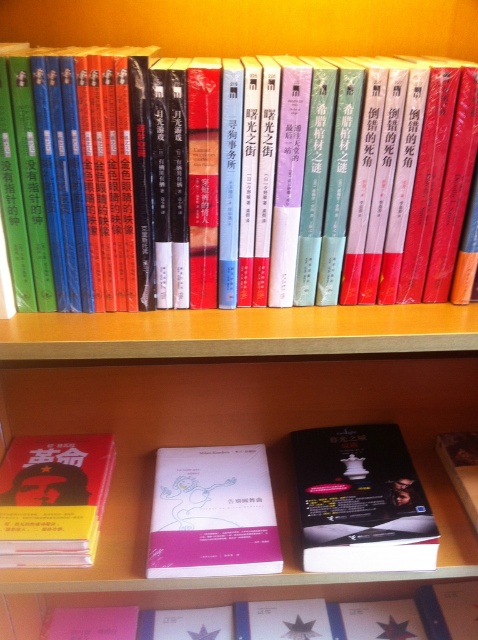
Which is in front, point (388, 547) or point (263, 492)?

Point (388, 547) is in front.

Between black matte book at center and pink matte book at center, which one has more height?

With more height is black matte book at center.

Is point (312, 547) behind point (147, 561)?

No, it is not.

The image size is (478, 640). I want to click on black matte book at center, so pyautogui.click(x=360, y=500).

Is hardcover book at center above pink matte book at center?

Yes, hardcover book at center is above pink matte book at center.

Describe the element at coordinates (245, 184) in the screenshot. I see `hardcover book at center` at that location.

What do you see at coordinates (245, 184) in the screenshot? I see `hardcover book at center` at bounding box center [245, 184].

Find the location of `hardcover book at center`. hardcover book at center is located at coordinates (245, 184).

Which of these two, black matte book at center or red matte book at lower left, stands taller?

With more height is black matte book at center.

Is black matte book at center further to camera compared to red matte book at lower left?

Yes, black matte book at center is further from the viewer.

The height and width of the screenshot is (640, 478). What are the coordinates of `black matte book at center` in the screenshot? It's located at (360, 500).

What are the coordinates of `black matte book at center` in the screenshot? It's located at (360, 500).